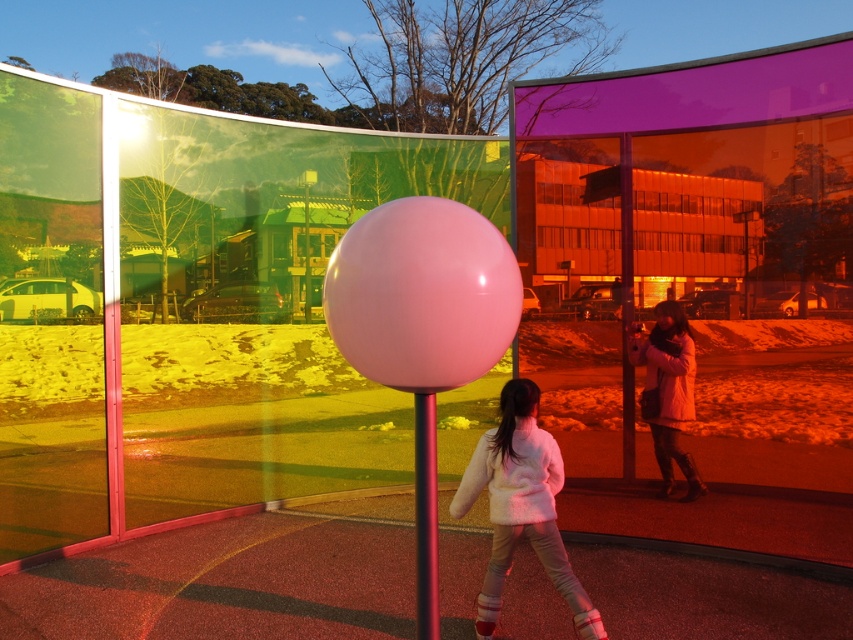
Question: Which object appears farthest from the camera in this image?

Choices:
 (A) glossy pink balloon at center
 (B) white fluffy coat at center

Answer: (B)

Question: Does glossy pink balloon at center appear on the left side of white fluffy coat at center?

Choices:
 (A) no
 (B) yes

Answer: (B)

Question: Is matte pink coat at right thinner than glossy plastic pole at center?

Choices:
 (A) yes
 (B) no

Answer: (B)

Question: Which point is closer to the camera?

Choices:
 (A) (669, 490)
 (B) (491, 577)
 (C) (421, 384)

Answer: (C)

Question: Can you confirm if glossy pink balloon at center is smaller than matte pink coat at right?

Choices:
 (A) no
 (B) yes

Answer: (B)

Question: Which object is farther from the camera taking this photo?

Choices:
 (A) glossy pink balloon at center
 (B) white fluffy coat at center
 (C) glossy plastic pole at center

Answer: (B)